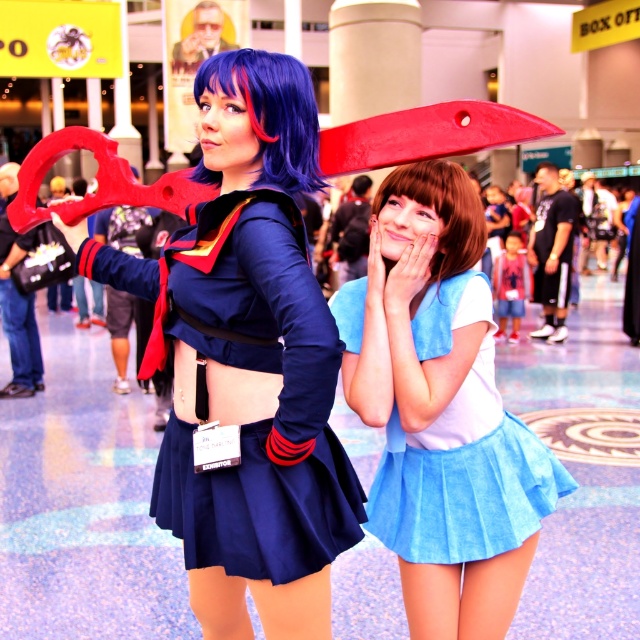
You are a photographer at the event and need to capture a clear shot of both the matte blue fabric skirt at center and the brown silky hair at center. Which object should you focus on first to ensure it appears sharp in the photo?

The matte blue fabric skirt at center is closer to the viewer than the brown silky hair at center, so you should focus on the matte blue fabric skirt at center first to ensure it is sharp. Since it is closer, focusing there will also keep the brown silky hair at center in acceptable focus if within the depth of field.